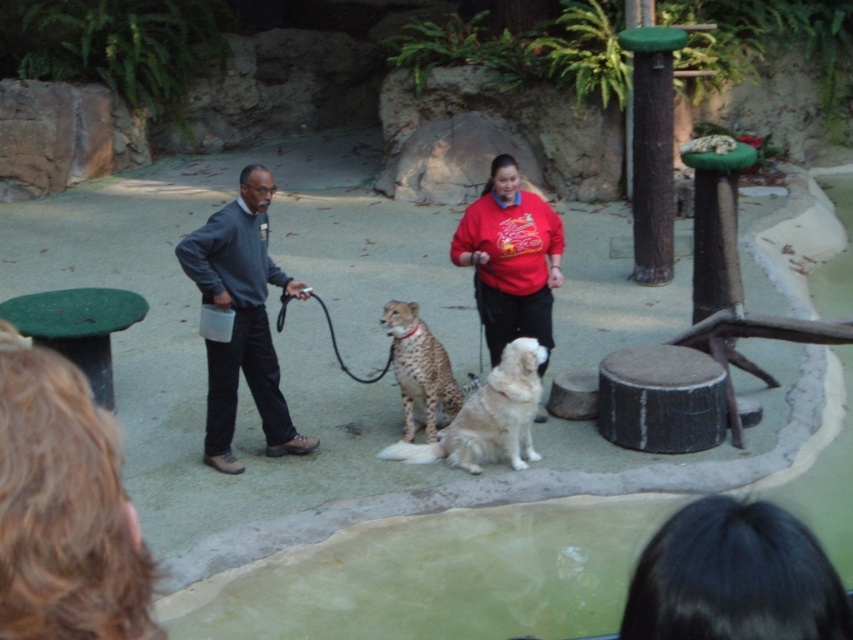
Which is more to the left, dark gray sweater at left or spotted fur cheetah at center?

Positioned to the left is dark gray sweater at left.

Is dark gray sweater at left bigger than spotted fur cheetah at center?

Yes.

Which is behind, point (270, 410) or point (424, 353)?

The point (424, 353) is more distant.

Identify the location of dark gray sweater at left. This screenshot has width=853, height=640. (241, 320).

Who is positioned more to the left, dark gray sweater at left or red cotton shirt at center?

dark gray sweater at left is more to the left.

The height and width of the screenshot is (640, 853). Describe the element at coordinates (241, 320) in the screenshot. I see `dark gray sweater at left` at that location.

The width and height of the screenshot is (853, 640). Identify the location of dark gray sweater at left. (241, 320).

Can you confirm if red cotton shirt at center is bigger than spotted fur cheetah at center?

Yes.

Is red cotton shirt at center to the right of spotted fur cheetah at center from the viewer's perspective?

Correct, you'll find red cotton shirt at center to the right of spotted fur cheetah at center.

This screenshot has width=853, height=640. Find the location of `red cotton shirt at center`. red cotton shirt at center is located at coordinates pos(509,259).